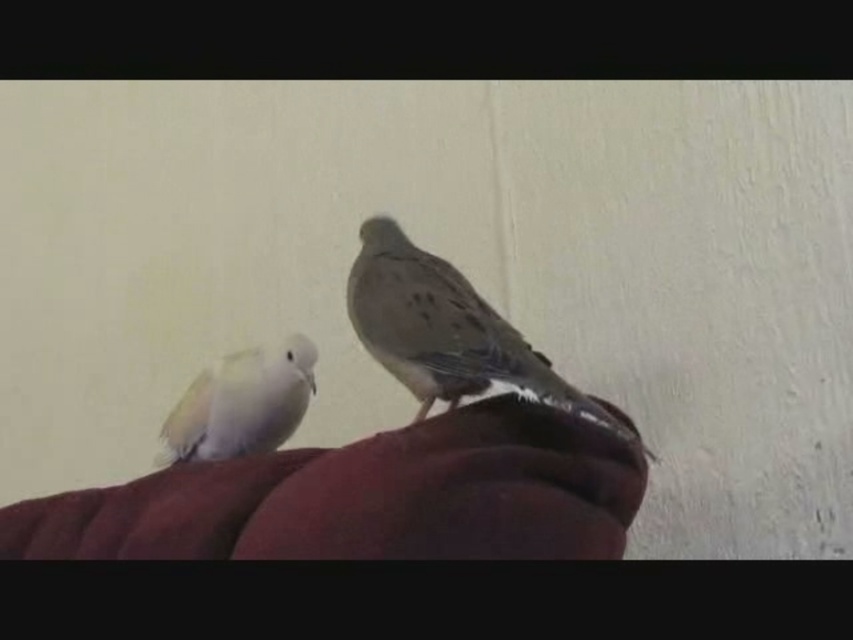
Question: Does brown speckled feather at center have a lesser width compared to white feathered bird at left?

Choices:
 (A) no
 (B) yes

Answer: (A)

Question: Can you confirm if brown speckled feather at center is positioned above white feathered bird at left?

Choices:
 (A) yes
 (B) no

Answer: (A)

Question: Does brown speckled feather at center have a lesser width compared to white feathered bird at left?

Choices:
 (A) yes
 (B) no

Answer: (B)

Question: Which of the following is the closest to the observer?

Choices:
 (A) brown speckled feather at center
 (B) white feathered bird at left

Answer: (A)